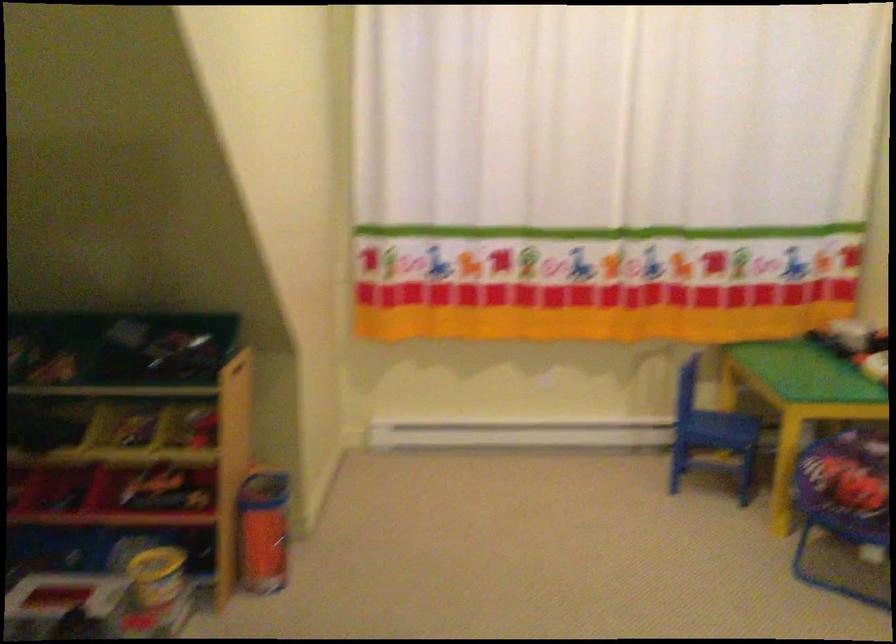
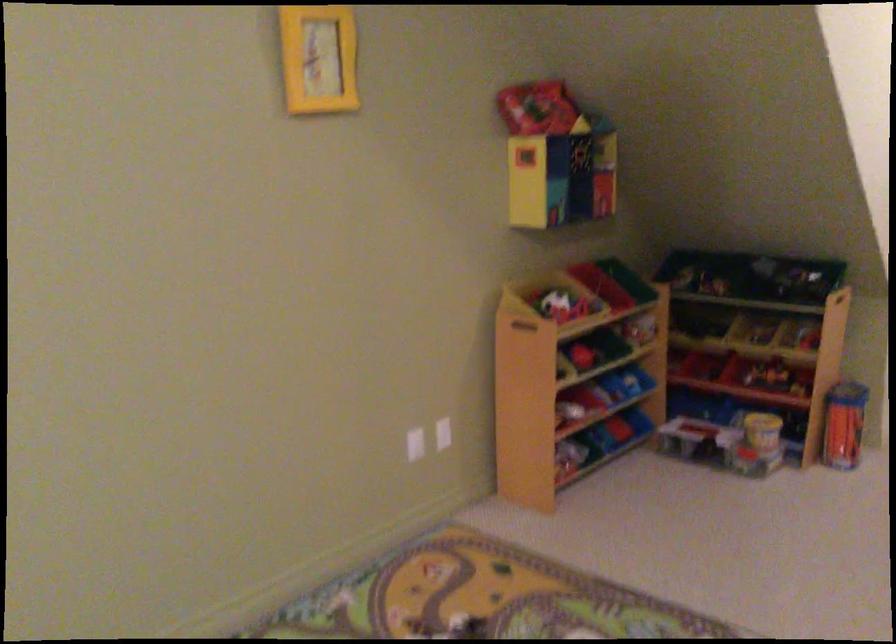
The point at (259,534) is marked in the first image. Where is the corresponding point in the second image?

(843, 424)